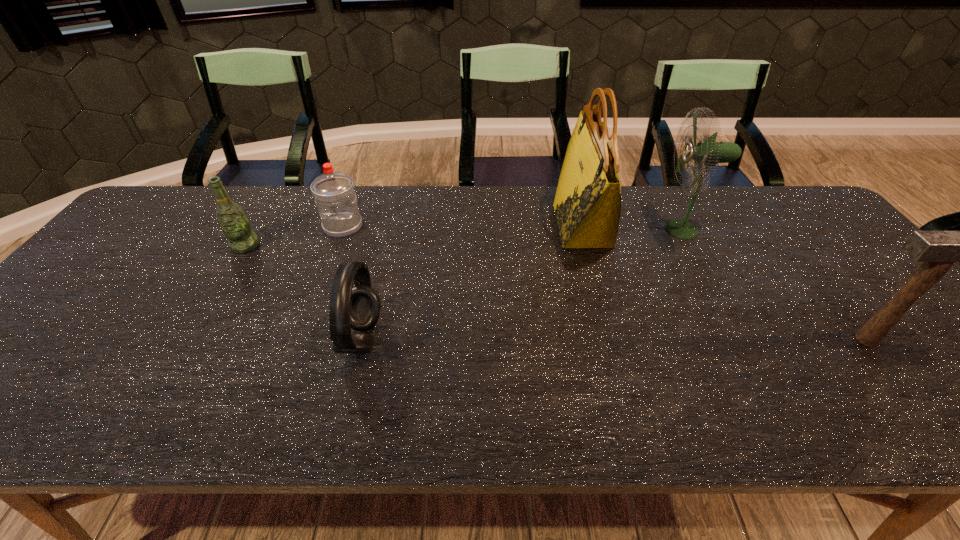
Where is `free area in between the fan and the headset`? This screenshot has height=540, width=960. free area in between the fan and the headset is located at coordinates (522, 284).

The image size is (960, 540). In order to click on free point between the tote bag and the fifth object from left to right in this screenshot , I will do `click(633, 227)`.

You are a GUI agent. You are given a task and a screenshot of the screen. Output one action in this format:
    pyautogui.click(x=<x>, y=<y>)
    Task: Click on the free space between the fifth object from right to left and the tote bag
    The width and height of the screenshot is (960, 540).
    Given the screenshot: What is the action you would take?
    pyautogui.click(x=463, y=226)

This screenshot has width=960, height=540. Identify the location of free spot between the rightmost object and the water bottle. (605, 283).

Find the location of a particular element. This screenshot has height=540, width=960. free space between the fourth object from left to right and the mallet is located at coordinates (724, 282).

Locate an element on the screen. This screenshot has width=960, height=540. empty space that is in between the fourth object from left to right and the leftmost object is located at coordinates (414, 235).

Identify the location of free space between the fan and the fourth object from right to left. This screenshot has height=540, width=960. (522, 284).

Locate which object ranks third in proximity to the fan. Please provide its 2D coordinates. Your answer should be formatted as a tuple, i.e. [(x, y)], where the tuple contains the x and y coordinates of a point satisfying the conditions above.

[(358, 308)]

Select which object is the closest to the water bottle. Please provide its 2D coordinates. Your answer should be formatted as a tuple, i.e. [(x, y)], where the tuple contains the x and y coordinates of a point satisfying the conditions above.

[(232, 219)]

Locate an element on the screen. blank area in the image that satisfies the following two spatial constraints: 1. on the earcups of the mallet; 2. on the left side of the headset is located at coordinates (362, 340).